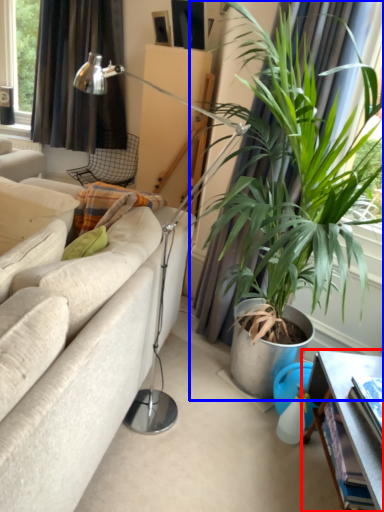
Question: Which of the following is the farthest to the observer, table (highlighted by a red box) or houseplant (highlighted by a blue box)?

Choices:
 (A) table
 (B) houseplant

Answer: (B)